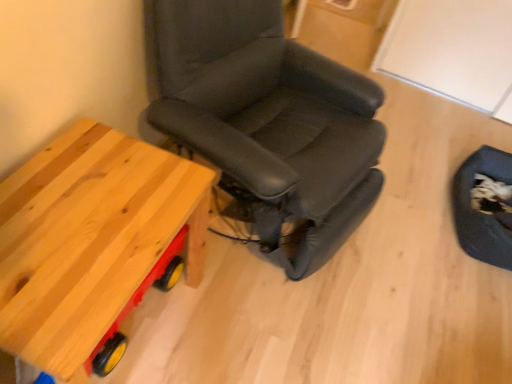
This screenshot has height=384, width=512. What are the coordinates of `dark blue fabric swivel chair at lower right` in the screenshot? It's located at (482, 213).

Identify the location of black leather chair at center. This screenshot has height=384, width=512. (270, 121).

Considering the sizes of objects black leather chair at center and dark blue fabric swivel chair at lower right in the image provided, who is shorter, black leather chair at center or dark blue fabric swivel chair at lower right?

dark blue fabric swivel chair at lower right is shorter.

From the image's perspective, which one is positioned lower, black leather chair at center or dark blue fabric swivel chair at lower right?

dark blue fabric swivel chair at lower right.

From the picture: Are black leather chair at center and dark blue fabric swivel chair at lower right beside each other?

No, black leather chair at center is not with dark blue fabric swivel chair at lower right.

Which object is closer to the camera taking this photo, natural wood table at left or black leather chair at center?

black leather chair at center is in front.

Which of these two, natural wood table at left or black leather chair at center, is smaller?

Smaller between the two is natural wood table at left.

Would you say natural wood table at left is inside or outside black leather chair at center?

natural wood table at left exists outside the volume of black leather chair at center.

From a real-world perspective, which object rests below the other?

From a 3D spatial view, natural wood table at left is below.

Does black leather chair at center have a larger size compared to natural wood table at left?

Yes.

Considering their positions, is black leather chair at center located in front of or behind natural wood table at left?

black leather chair at center is in front of natural wood table at left.

From a real-world perspective, which is physically below, black leather chair at center or natural wood table at left?

natural wood table at left.

From the image's perspective, is black leather chair at center above natural wood table at left?

Yes, from the image's perspective, black leather chair at center is on top of natural wood table at left.

Relative to dark blue fabric swivel chair at lower right, is natural wood table at left in front or behind?

natural wood table at left is in front of dark blue fabric swivel chair at lower right.

Looking at this image, is natural wood table at left not inside dark blue fabric swivel chair at lower right?

That's correct, natural wood table at left is outside of dark blue fabric swivel chair at lower right.

From the image's perspective, would you say natural wood table at left is shown under dark blue fabric swivel chair at lower right?

Yes, from the image's perspective, natural wood table at left is beneath dark blue fabric swivel chair at lower right.

In the image, there is a dark blue fabric swivel chair at lower right. Identify the location of table below it (from the image's perspective). (90, 240).

Can you tell me how much dark blue fabric swivel chair at lower right and natural wood table at left differ in facing direction?

175 degrees separate the facing orientations of dark blue fabric swivel chair at lower right and natural wood table at left.

Which point is more distant from viewer, (470, 176) or (147, 176)?

The point (470, 176) is farther.

Looking at their sizes, would you say dark blue fabric swivel chair at lower right is wider or thinner than natural wood table at left?

Considering their sizes, dark blue fabric swivel chair at lower right looks slimmer than natural wood table at left.

Is point (455, 212) farther from camera compared to point (262, 183)?

Yes.

Considering the positions of objects dark blue fabric swivel chair at lower right and black leather chair at center in the image provided, who is behind, dark blue fabric swivel chair at lower right or black leather chair at center?

dark blue fabric swivel chair at lower right.

Could you tell me if dark blue fabric swivel chair at lower right is facing black leather chair at center?

Yes.

Identify the location of swivel chair below the black leather chair at center (from the image's perspective). This screenshot has width=512, height=384. (482, 213).

You are a GUI agent. You are given a task and a screenshot of the screen. Output one action in this format:
    pyautogui.click(x=<x>, y=<y>)
    Task: Click on the chair above the dark blue fabric swivel chair at lower right (from a real-world perspective)
    The width and height of the screenshot is (512, 384).
    Given the screenshot: What is the action you would take?
    pyautogui.click(x=270, y=121)

Identify the location of table that appears below the black leather chair at center (from a real-world perspective). (90, 240).

Estimate the real-world distances between objects in this image. Which object is further from black leather chair at center, natural wood table at left or dark blue fabric swivel chair at lower right?

dark blue fabric swivel chair at lower right lies further to black leather chair at center than the other object.

Which object lies nearer to the anchor point dark blue fabric swivel chair at lower right, black leather chair at center or natural wood table at left?

black leather chair at center is positioned closer to the anchor dark blue fabric swivel chair at lower right.

Which object lies further to the anchor point natural wood table at left, black leather chair at center or dark blue fabric swivel chair at lower right?

The object further to natural wood table at left is dark blue fabric swivel chair at lower right.

Estimate the real-world distances between objects in this image. Which object is closer to natural wood table at left, dark blue fabric swivel chair at lower right or black leather chair at center?

black leather chair at center.

When comparing their distances from black leather chair at center, does dark blue fabric swivel chair at lower right or natural wood table at left seem closer?

natural wood table at left is closer to black leather chair at center.

Looking at the image, which one is located further to dark blue fabric swivel chair at lower right, natural wood table at left or black leather chair at center?

natural wood table at left is positioned further to the anchor dark blue fabric swivel chair at lower right.

I want to click on chair between natural wood table at left and dark blue fabric swivel chair at lower right in the horizontal direction, so click(270, 121).